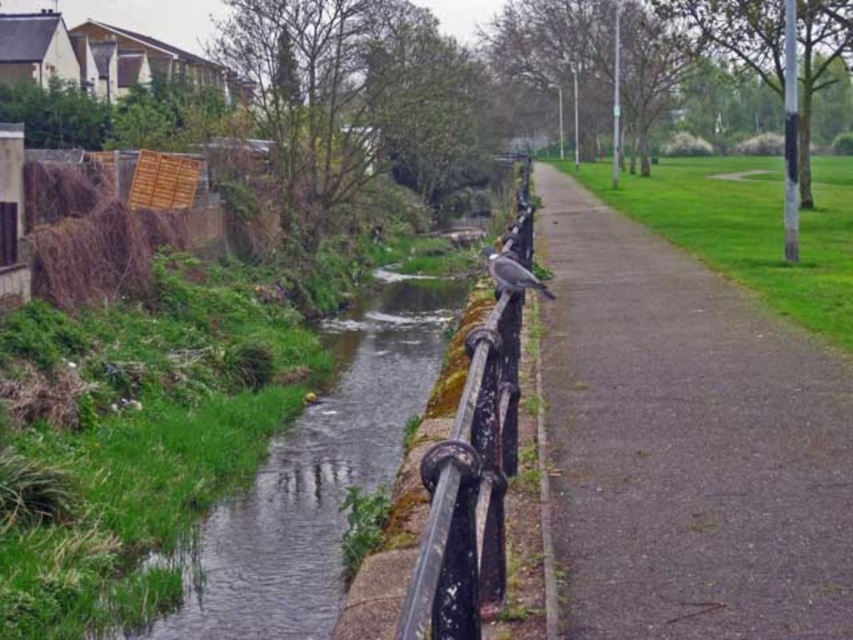
Can you confirm if gray asphalt pavement at center is positioned below gray matte bird at center?

Correct, gray asphalt pavement at center is located below gray matte bird at center.

Which is behind, point (564, 262) or point (509, 288)?

The point (564, 262) is behind.

Image resolution: width=853 pixels, height=640 pixels. Identify the location of gray asphalt pavement at center. (685, 442).

Does gray asphalt pavement at center have a larger size compared to green mossy water at center?

Yes, gray asphalt pavement at center is bigger than green mossy water at center.

Is gray asphalt pavement at center in front of green mossy water at center?

Yes.

Is point (650, 531) farther from viewer compared to point (372, 333)?

That is False.

Identify the location of gray asphalt pavement at center. This screenshot has width=853, height=640. (685, 442).

Looking at this image, can you confirm if green mossy water at center is taller than gray matte bird at center?

Correct, green mossy water at center is much taller as gray matte bird at center.

Between green mossy water at center and gray matte bird at center, which one has less height?

gray matte bird at center is shorter.

Where is `green mossy water at center`? This screenshot has width=853, height=640. green mossy water at center is located at coordinates (315, 477).